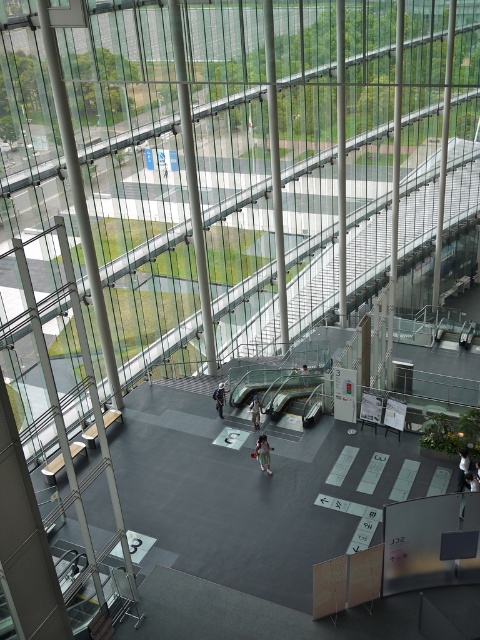
Can you confirm if white fabric shirt at center is positioned to the right of light blue fabric jacket at center?

Yes, white fabric shirt at center is to the right of light blue fabric jacket at center.

What do you see at coordinates (463, 467) in the screenshot?
I see `white fabric shirt at center` at bounding box center [463, 467].

Identify the location of white fabric shirt at center. (463, 467).

Who is taller, light brown fabric pants at center or white fabric shirt at center?

With more height is white fabric shirt at center.

Is light brown fabric pants at center thinner than white fabric shirt at center?

In fact, light brown fabric pants at center might be wider than white fabric shirt at center.

Between point (262, 449) and point (465, 468), which one is positioned behind?

Point (262, 449)

Find the location of a particular element. This screenshot has width=480, height=640. light brown fabric pants at center is located at coordinates [x=263, y=452].

At what (x,y) coordinates should I click in order to perform the action: click on white fabric shirt at center. Please return your answer as a coordinate pair (x, y). The height and width of the screenshot is (640, 480). Looking at the image, I should click on (463, 467).

Between white fabric shirt at center and dark blue jeans at center, which one has more height?

white fabric shirt at center is taller.

This screenshot has height=640, width=480. In order to click on white fabric shirt at center in this screenshot , I will do pos(463,467).